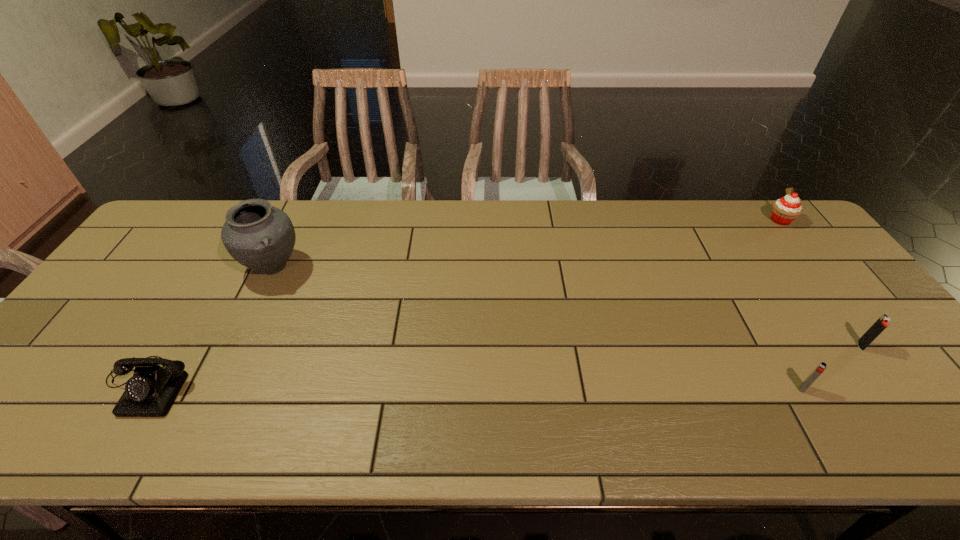
In the image, there is a desktop. Where is `vacant space at the right edge`? vacant space at the right edge is located at coordinates pos(908,404).

At what (x,y) coordinates should I click in order to perform the action: click on unoccupied position between the left igniter and the tallest object. Please return your answer as a coordinate pair (x, y). The height and width of the screenshot is (540, 960). Looking at the image, I should click on (538, 328).

At what (x,y) coordinates should I click in order to perform the action: click on vacant space that is in between the third object from right to left and the tallest object. Please return your answer as a coordinate pair (x, y). This screenshot has width=960, height=540. Looking at the image, I should click on (538, 328).

This screenshot has width=960, height=540. In order to click on free space between the shorter igniter and the second farthest object in this screenshot , I will do `click(538, 328)`.

This screenshot has height=540, width=960. In order to click on vacant point located between the telephone and the third object from right to left in this screenshot , I will do `click(475, 387)`.

Find the location of a particular element. vacant space that's between the farthest object and the farther igniter is located at coordinates (821, 282).

You are a GUI agent. You are given a task and a screenshot of the screen. Output one action in this format:
    pyautogui.click(x=<x>, y=<y>)
    Task: Click on the vacant space that's between the third object from right to left and the farther igniter
    The height and width of the screenshot is (540, 960).
    Given the screenshot: What is the action you would take?
    pyautogui.click(x=831, y=367)

Where is `free space between the urn and the telephone`? free space between the urn and the telephone is located at coordinates (210, 326).

The image size is (960, 540). I want to click on vacant area that lies between the tallest object and the telephone, so click(210, 326).

Image resolution: width=960 pixels, height=540 pixels. I want to click on vacant space in between the telephone and the farthest object, so click(x=464, y=302).